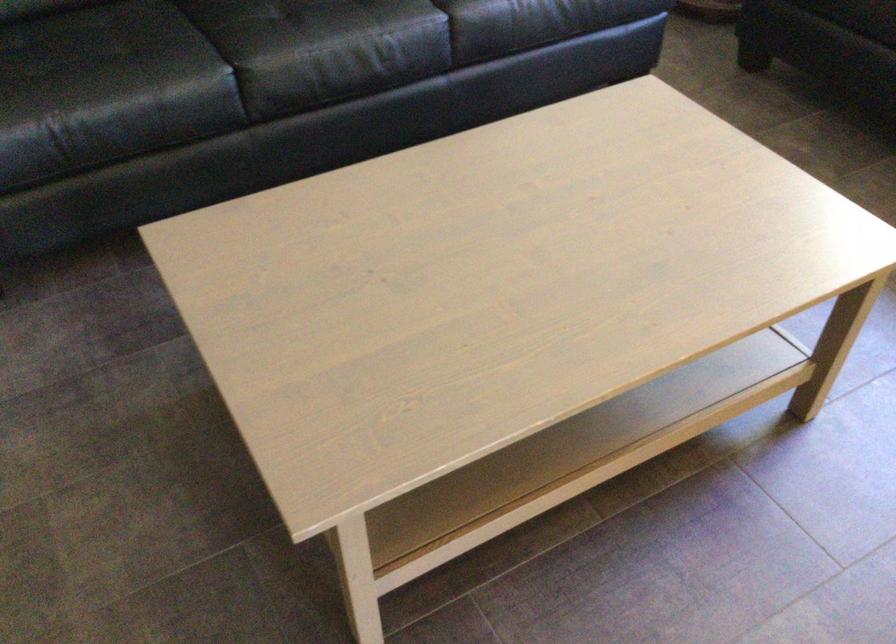
Image resolution: width=896 pixels, height=644 pixels. What do you see at coordinates (221, 78) in the screenshot? I see `the sofa sitting surface` at bounding box center [221, 78].